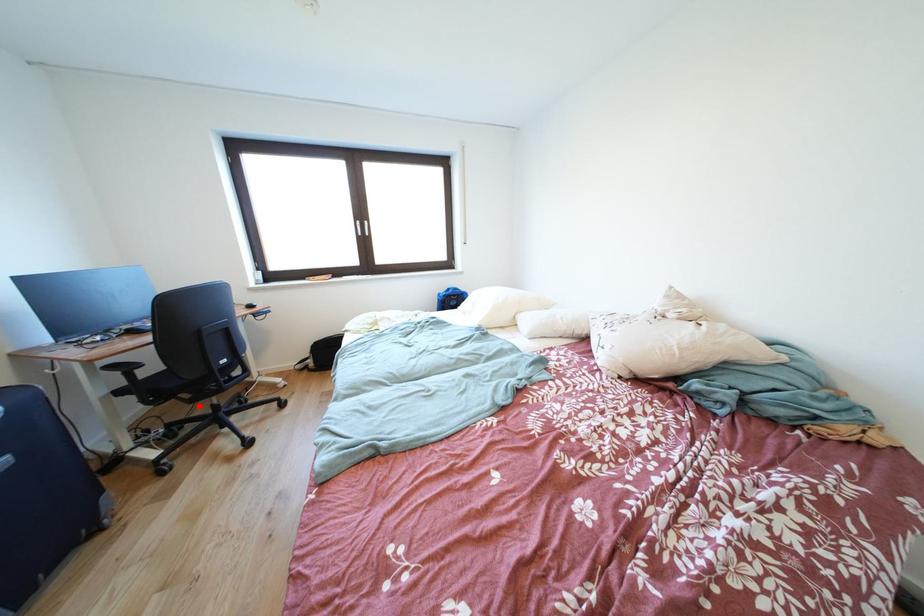
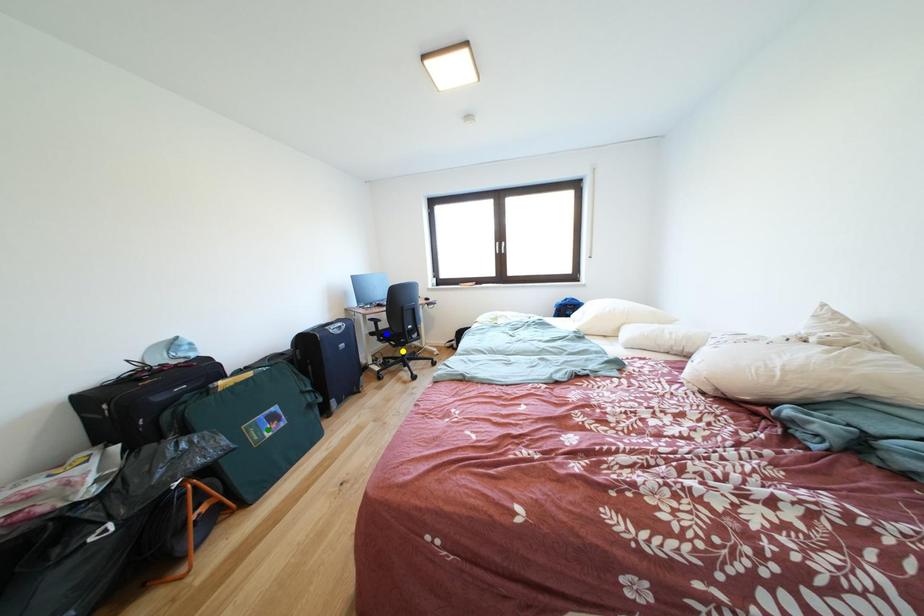
Question: I am providing you with two images of the same scene from different viewpoints. A red point is marked on the first image. You are given multiple points on the second image. Which spot in image 2 lines up with the point in image 1?

Choices:
 (A) green point
 (B) yellow point
 (C) blue point

Answer: (B)